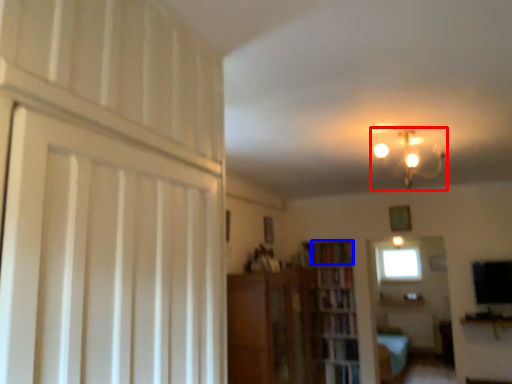
Question: Among these objects, which one is nearest to the camera, lamp (highlighted by a red box) or book (highlighted by a blue box)?

Choices:
 (A) lamp
 (B) book

Answer: (A)